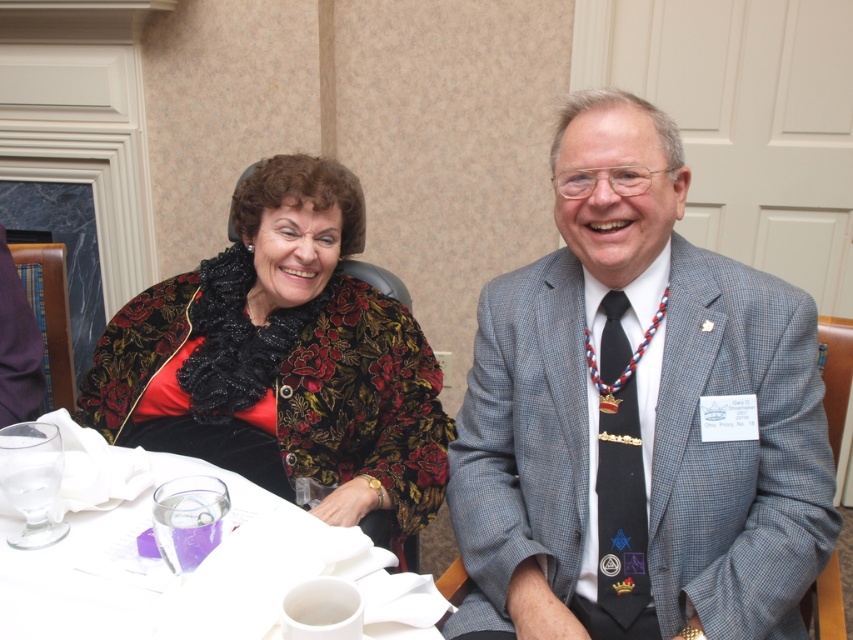
You are a photographer at a formal event. You need to determine if the gray checkered suit at center will fit on a table that can only hold items smaller than the white paper napkin at lower left. Can it fit?

The gray checkered suit at center is bigger than the white paper napkin at lower left, so it cannot fit on the table since it exceeds the size limit.

You are organizing a photo shoot and need to arrange two outfits on a mannequin. The outfits are the gray checkered suit at center and the floral velvet jacket at upper left. Based on the image, which outfit requires more space to display properly?

The floral velvet jacket at upper left requires more space to display properly because it occupies more space than the gray checkered suit at center according to the description.

You are a photographer at a formal event. You need to adjust the lighting so that the gray checkered suit at center and the white paper napkin at lower left are both visible. Which object is closer to the camera, and therefore requires more direct lighting?

The gray checkered suit at center is closer to the camera than the white paper napkin at lower left, so it requires more direct lighting to ensure visibility.